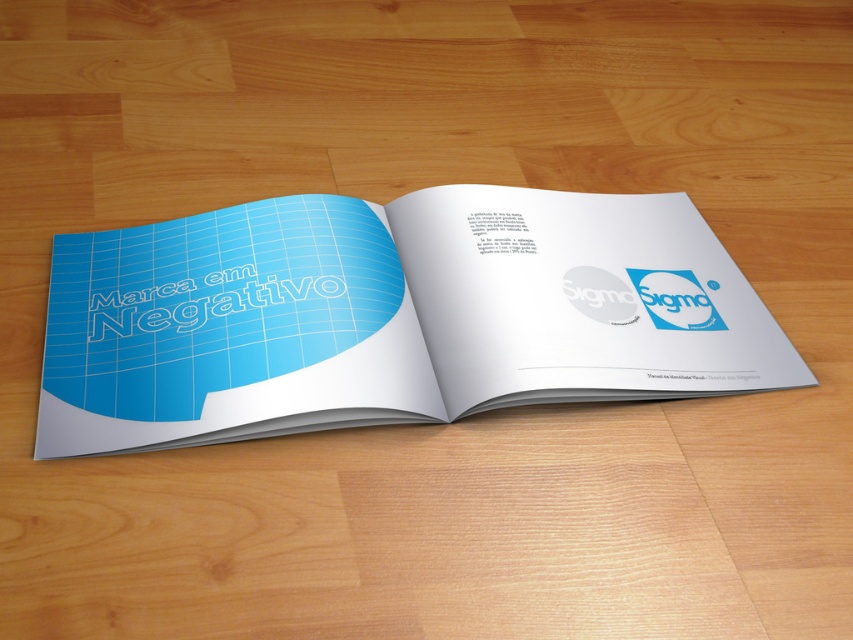
Who is taller, blue paper book at center or blue glossy logo at center?

With more height is blue paper book at center.

Between blue paper book at center and blue glossy logo at center, which one appears on the right side from the viewer's perspective?

blue glossy logo at center

Locate an element on the screen. The width and height of the screenshot is (853, 640). blue paper book at center is located at coordinates (384, 316).

In order to click on blue paper book at center in this screenshot , I will do `click(384, 316)`.